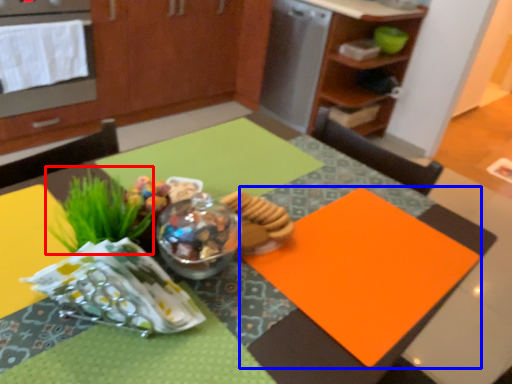
Question: Which object appears farthest to the camera in this image, grass (highlighted by a red box) or place mat (highlighted by a blue box)?

Choices:
 (A) grass
 (B) place mat

Answer: (B)